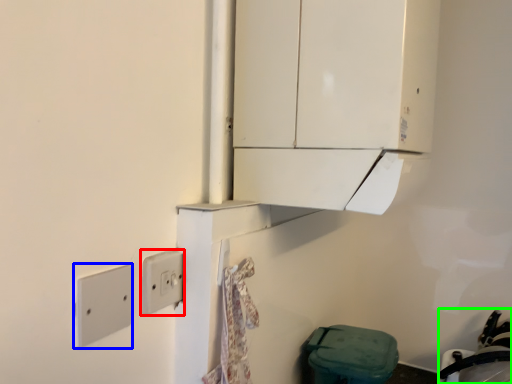
Question: Estimate the real-world distances between objects in this image. Which object is farther from light switch (highlighted by a red box), light switch (highlighted by a blue box) or sink (highlighted by a green box)?

Choices:
 (A) light switch
 (B) sink

Answer: (B)